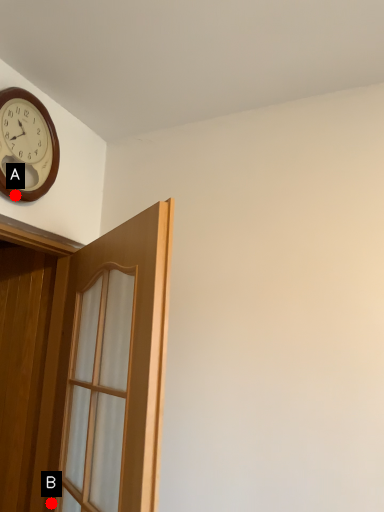
Question: Two points are circled on the image, labeled by A and B beside each circle. Which point is further to the camera?

Choices:
 (A) A is further
 (B) B is further

Answer: (B)